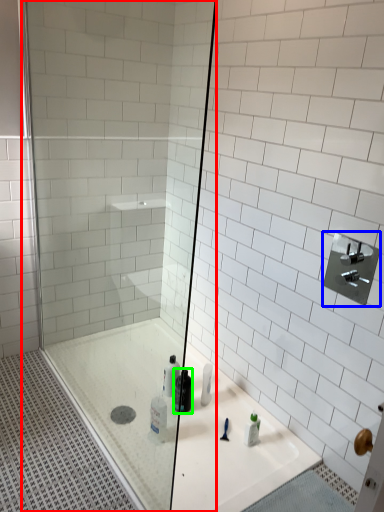
Question: Which object is the farthest from shower door (highlighted by a red box)? Choose among these: shower (highlighted by a blue box) or mouthwash (highlighted by a green box).

Choices:
 (A) shower
 (B) mouthwash

Answer: (A)